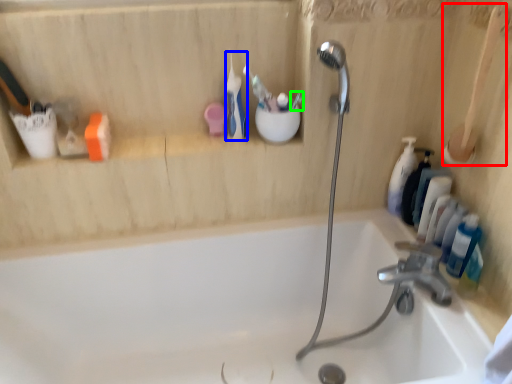
Question: Which object is positioned closest to brush (highlighted by a red box)? Select from toothbrush (highlighted by a blue box) and toothbrush (highlighted by a green box).

Choices:
 (A) toothbrush
 (B) toothbrush

Answer: (B)